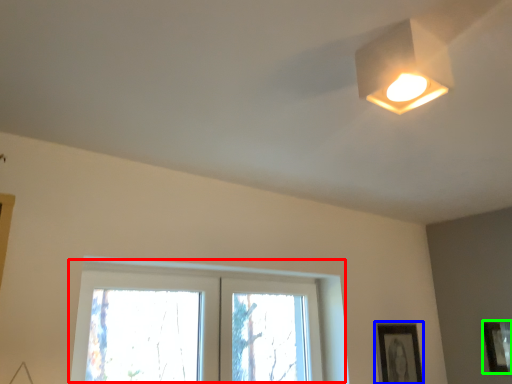
Question: Considering the real-world distances, which object is farthest from window (highlighted by a red box)? picture frame (highlighted by a blue box) or picture frame (highlighted by a green box)?

Choices:
 (A) picture frame
 (B) picture frame

Answer: (B)